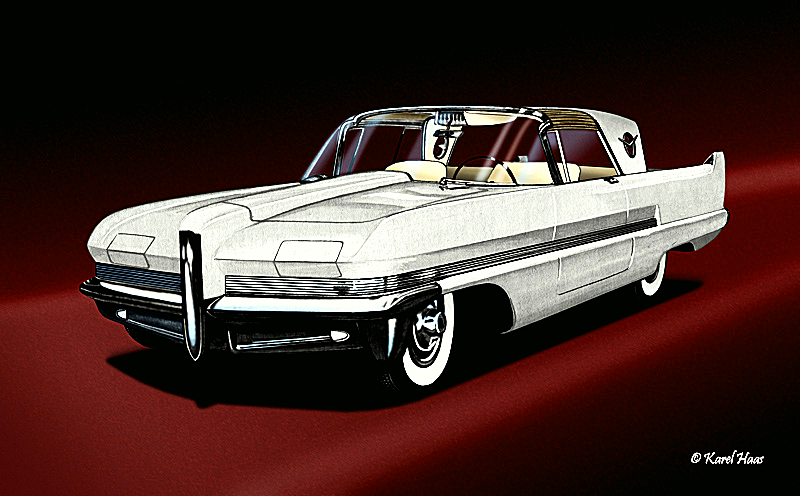
Where is `seats`? This screenshot has width=800, height=496. seats is located at coordinates (525, 169), (430, 171), (590, 174), (470, 171), (453, 173).